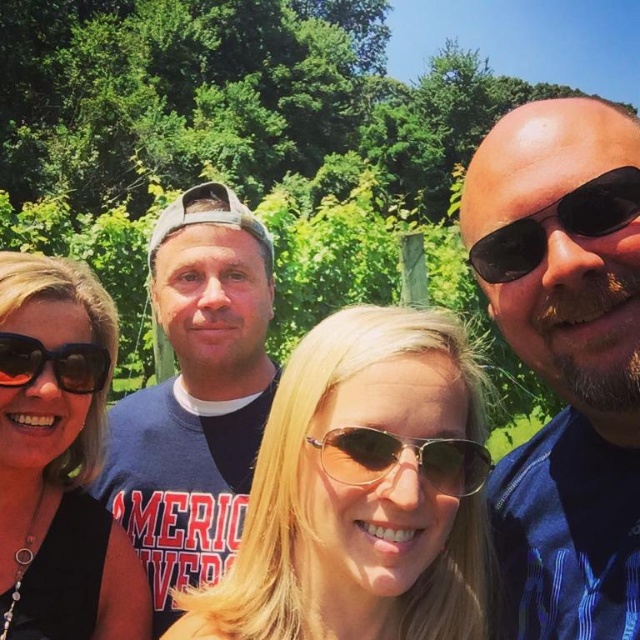
Question: Which point is farther to the camera?

Choices:
 (A) black plastic sunglasses at right
 (B) gold metallic sunglasses at center
 (C) black matte sunglasses at upper left
 (D) blonde hair at center

Answer: (C)

Question: Which point is farther to the camera?

Choices:
 (A) gold metallic sunglasses at center
 (B) blue cotton t-shirt at center
 (C) black plastic sunglasses at right

Answer: (B)

Question: Does gold metallic sunglasses at center come behind black plastic sunglasses at left?

Choices:
 (A) yes
 (B) no

Answer: (B)

Question: Among these objects, which one is farthest from the camera?

Choices:
 (A) blue cotton t-shirt at center
 (B) blonde hair at center
 (C) black plastic sunglasses at right

Answer: (A)

Question: Does black plastic sunglasses at right have a larger size compared to gold metallic sunglasses at center?

Choices:
 (A) no
 (B) yes

Answer: (B)

Question: In this image, where is blue cotton t-shirt at center located relative to black matte sunglasses at upper left?

Choices:
 (A) right
 (B) left

Answer: (A)